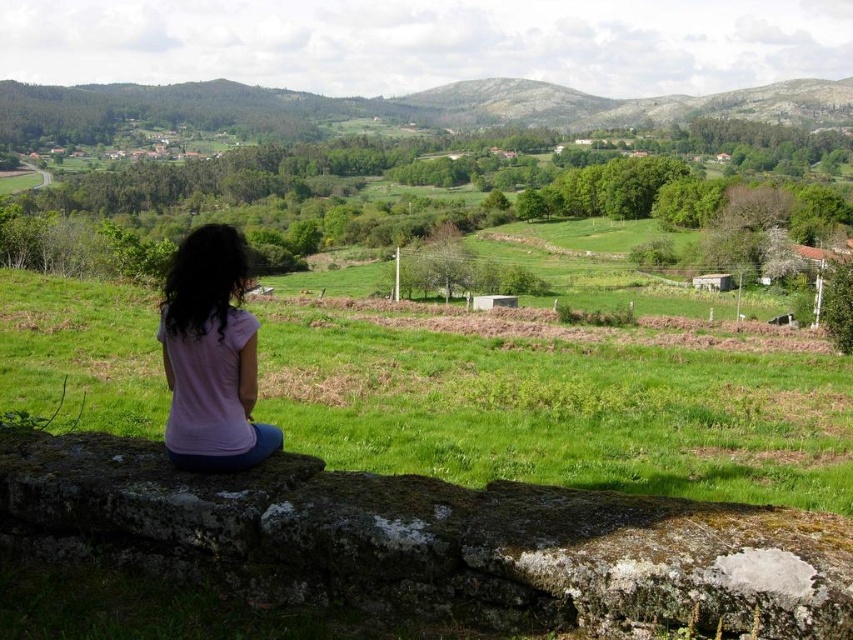
Question: Considering the real-world distances, which object is farthest from the green grassy field at center?

Choices:
 (A) mossy stone at center
 (B) pink fabric shirt at lower left

Answer: (A)

Question: Is the position of green grassy field at center less distant than that of pink fabric shirt at lower left?

Choices:
 (A) yes
 (B) no

Answer: (B)

Question: Among these points, which one is farthest from the camera?

Choices:
 (A) (245, 410)
 (B) (578, 472)
 (C) (666, 563)

Answer: (B)

Question: Among these points, which one is farthest from the camera?

Choices:
 (A) pos(170,323)
 (B) pos(804,621)

Answer: (A)

Question: Can you confirm if mossy stone at center is thinner than green grassy field at center?

Choices:
 (A) yes
 (B) no

Answer: (A)

Question: Does mossy stone at center lie in front of green grassy field at center?

Choices:
 (A) no
 (B) yes

Answer: (B)